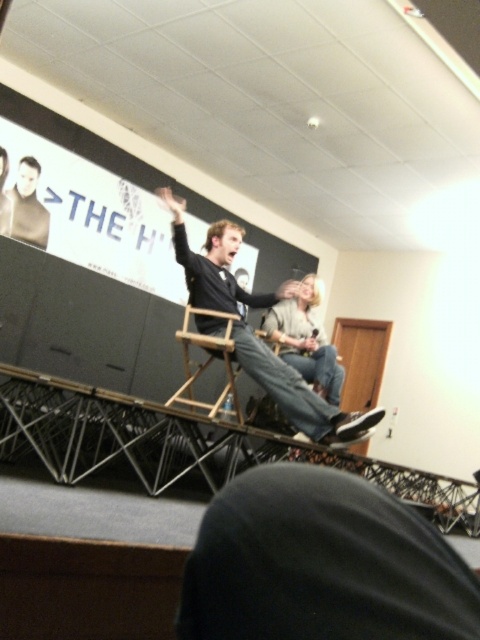
Describe the element at coordinates (298, 394) in the screenshot. Image resolution: width=480 pixels, height=640 pixels. I see `dark gray cotton shirt at center` at that location.

Measure the distance between point (x=298, y=404) and camera.

The distance of point (x=298, y=404) from camera is 3.58 meters.

You are a GUI agent. You are given a task and a screenshot of the screen. Output one action in this format:
    pyautogui.click(x=<x>, y=<y>)
    Task: Click on the dark gray cotton shirt at center
    
    Given the screenshot: What is the action you would take?
    pyautogui.click(x=298, y=394)

Does dark gray cotton shirt at center have a greater width compared to wooden director's chair at center?

Correct, the width of dark gray cotton shirt at center exceeds that of wooden director's chair at center.

Which is behind, point (326, 428) or point (188, 340)?

The point (188, 340) is behind.

Identify the location of dark gray cotton shirt at center. This screenshot has height=640, width=480. (298, 394).

Is white matte projection screen at upper center positioned at the back of matte black shirt at left?

No, white matte projection screen at upper center is in front of matte black shirt at left.

Is white matte projection screen at upper center positioned in front of matte black shirt at left?

Yes, it is.

Does point (314, 257) lie behind point (28, 198)?

Yes, it is behind point (28, 198).

Find the location of `white matte projection screen at upper center`. white matte projection screen at upper center is located at coordinates (155, 182).